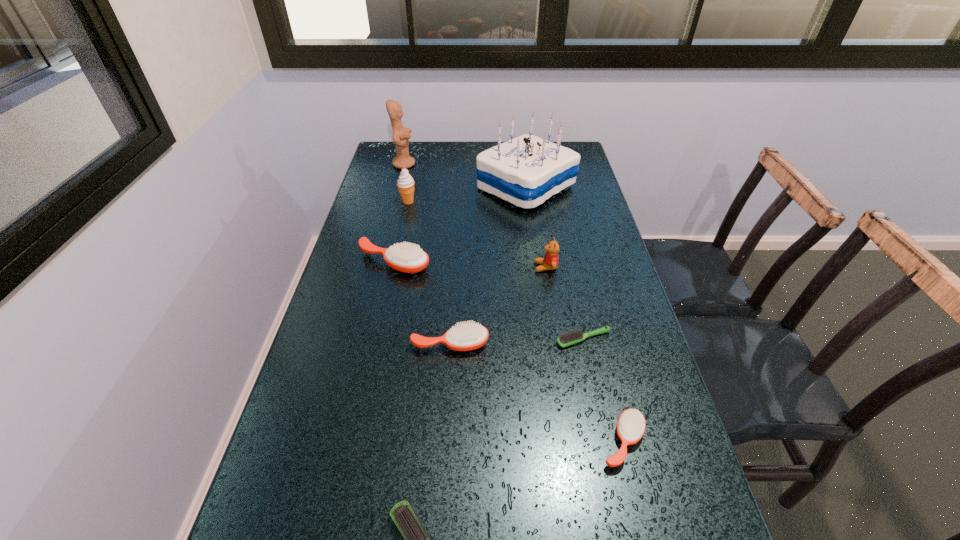
Locate an element on the screen. The image size is (960, 540). object that is at the far left corner is located at coordinates (401, 135).

Image resolution: width=960 pixels, height=540 pixels. I want to click on object that is positioned at the far right corner, so click(527, 170).

Locate an element on the screen. The height and width of the screenshot is (540, 960). free space at the far edge of the desktop is located at coordinates (423, 160).

At what (x,y) coordinates should I click in order to perform the action: click on free point at the left edge. Please return your answer as a coordinate pair (x, y). The height and width of the screenshot is (540, 960). Looking at the image, I should click on (335, 501).

Locate an element on the screen. The height and width of the screenshot is (540, 960). free region at the right edge is located at coordinates (649, 380).

The height and width of the screenshot is (540, 960). Find the location of `vacant point at the far left corner`. vacant point at the far left corner is located at coordinates (414, 169).

Locate an element on the screen. empty space that is in between the rightmost orange hairbrush and the figurine is located at coordinates (514, 302).

Find the location of a particular element. The width and height of the screenshot is (960, 540). free area in between the shortest object and the nearest orange hairbrush is located at coordinates (603, 390).

At what (x,y) coordinates should I click in order to perform the action: click on empty location between the icecream and the blue birthday cake. Please return your answer as a coordinate pair (x, y). The width and height of the screenshot is (960, 540). Looking at the image, I should click on (468, 194).

Where is `free space between the shortest object and the second nearest object`? The height and width of the screenshot is (540, 960). free space between the shortest object and the second nearest object is located at coordinates (603, 390).